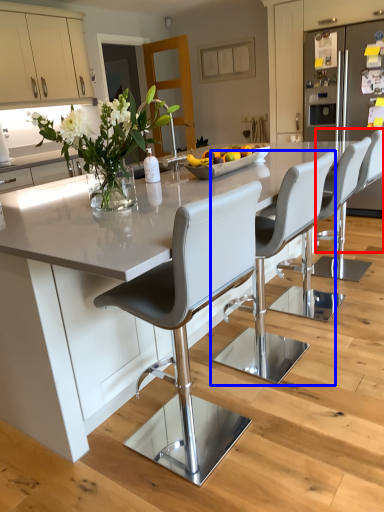
Question: Which point is closer to the camera, chair (highlighted by a red box) or chair (highlighted by a blue box)?

Choices:
 (A) chair
 (B) chair

Answer: (B)